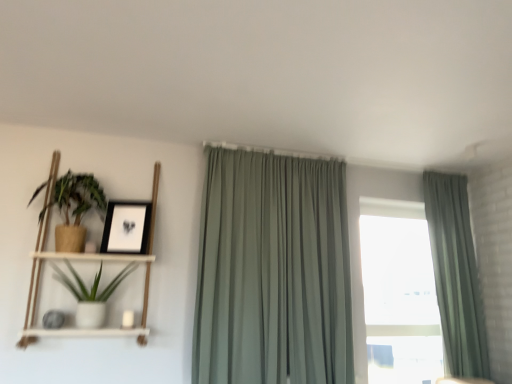
Question: From a real-world perspective, is matte brown pot at left, the 2th houseplant from the bottom, over white wood shelf at left?

Choices:
 (A) yes
 (B) no

Answer: (A)

Question: From the image's perspective, is matte brown pot at left, the 2th houseplant from the bottom, beneath white wood shelf at left?

Choices:
 (A) no
 (B) yes

Answer: (A)

Question: Could you tell me if matte brown pot at left, the 2th houseplant from the bottom, is facing white wood shelf at left?

Choices:
 (A) yes
 (B) no

Answer: (A)

Question: Is matte brown pot at left, positioned as the first houseplant in top-to-bottom order, bigger than white wood shelf at left?

Choices:
 (A) yes
 (B) no

Answer: (B)

Question: Is matte brown pot at left, the 2th houseplant from the bottom, closer to camera compared to white wood shelf at left?

Choices:
 (A) no
 (B) yes

Answer: (A)

Question: Is sage green fabric curtain at center, acting as the first curtain starting from the left, to the left or to the right of white wood shelf at left in the image?

Choices:
 (A) right
 (B) left

Answer: (A)

Question: Relative to white wood shelf at left, is sage green fabric curtain at center, acting as the second curtain starting from the right, in front or behind?

Choices:
 (A) front
 (B) behind

Answer: (B)

Question: Choose the correct answer: Is sage green fabric curtain at center, acting as the first curtain starting from the left, inside white wood shelf at left or outside it?

Choices:
 (A) outside
 (B) inside

Answer: (A)

Question: From a real-world perspective, is sage green fabric curtain at center, acting as the second curtain starting from the right, above or below white wood shelf at left?

Choices:
 (A) below
 (B) above

Answer: (A)

Question: From the image's perspective, is matte black picture frame at upper left located above or below matte brown pot at left, positioned as the first houseplant in top-to-bottom order?

Choices:
 (A) below
 (B) above

Answer: (A)

Question: From a real-world perspective, relative to matte brown pot at left, positioned as the first houseplant in top-to-bottom order, is matte black picture frame at upper left vertically above or below?

Choices:
 (A) below
 (B) above

Answer: (A)

Question: Considering the positions of matte black picture frame at upper left and matte brown pot at left, the 2th houseplant from the bottom, in the image, is matte black picture frame at upper left taller or shorter than matte brown pot at left, the 2th houseplant from the bottom,?

Choices:
 (A) short
 (B) tall

Answer: (A)

Question: Relative to matte brown pot at left, the 2th houseplant from the bottom, is matte black picture frame at upper left in front or behind?

Choices:
 (A) behind
 (B) front

Answer: (A)

Question: In terms of size, does matte brown pot at left, the 2th houseplant from the bottom, appear bigger or smaller than sage green fabric curtain at right, which is counted as the first curtain, starting from the right?

Choices:
 (A) small
 (B) big

Answer: (A)

Question: From the image's perspective, is matte brown pot at left, the 2th houseplant from the bottom, positioned above or below sage green fabric curtain at right, placed as the second curtain when sorted from left to right?

Choices:
 (A) above
 (B) below

Answer: (A)